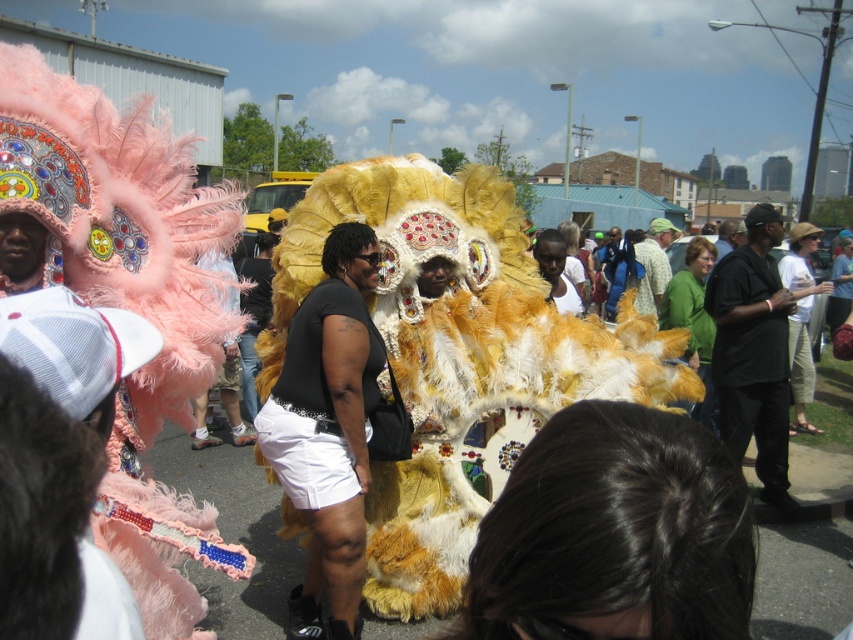
Question: Does fuzzy yellow costume at center appear under black mesh tank top at center?

Choices:
 (A) yes
 (B) no

Answer: (B)

Question: Which of these objects is positioned farthest from the fuzzy yellow costume at center?

Choices:
 (A) white cotton pants at center
 (B) feathered pink costume at left
 (C) black mesh tank top at center
 (D) black cotton shirt at center

Answer: (A)

Question: Estimate the real-world distances between objects in this image. Which object is closer to the white cotton pants at center?

Choices:
 (A) fuzzy yellow costume at center
 (B) black cotton shirt at center
 (C) black mesh tank top at center

Answer: (B)

Question: Which point is farther from the camera taking this photo?

Choices:
 (A) (737, 448)
 (B) (352, 317)
 (C) (386, 586)

Answer: (A)

Question: Does black cotton shirt at center have a smaller size compared to white cotton pants at center?

Choices:
 (A) yes
 (B) no

Answer: (B)

Question: Is feathered pink costume at left bigger than white cotton pants at center?

Choices:
 (A) yes
 (B) no

Answer: (A)